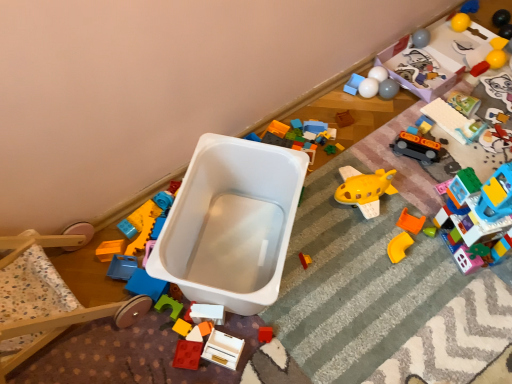
You are a GUI agent. You are given a task and a screenshot of the screen. Output one action in this format:
    pyautogui.click(x=<x>, y=<y>)
    Task: Click on the vacant space in between white plastic toy at center, the 14th toy when ordered from right to left, and translucent plastic building blocks at right, positioned as the 12th toy in left-to-right order
    Image resolution: width=512 pixels, height=384 pixels.
    Given the screenshot: What is the action you would take?
    pyautogui.click(x=371, y=266)